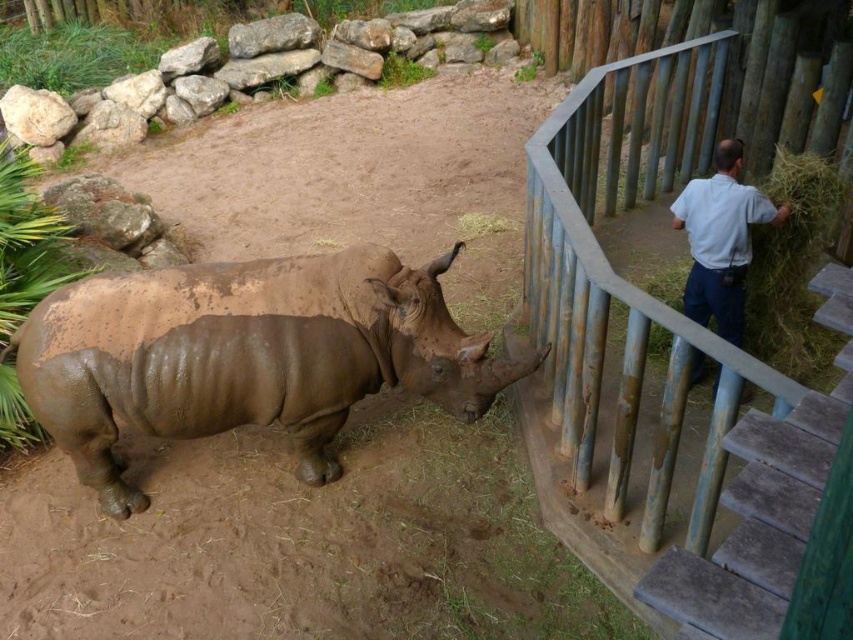
Question: Does muddy brown rhinoceros at lower left have a smaller size compared to rustic wooden railing at right?

Choices:
 (A) no
 (B) yes

Answer: (B)

Question: Does rusty metal stairs at right have a larger size compared to white shirt at upper right?

Choices:
 (A) no
 (B) yes

Answer: (B)

Question: Can you confirm if rustic wooden railing at right is bigger than white shirt at upper right?

Choices:
 (A) yes
 (B) no

Answer: (A)

Question: Which is farther from the rusty metal stairs at right?

Choices:
 (A) white shirt at upper right
 (B) muddy brown rhinoceros at lower left

Answer: (B)

Question: Which point is closer to the camera?

Choices:
 (A) rusty metal stairs at right
 (B) white shirt at upper right
 (C) muddy brown rhinoceros at lower left

Answer: (A)

Question: Which point appears farthest from the camera in this image?

Choices:
 (A) (604, 305)
 (B) (283, 353)

Answer: (B)